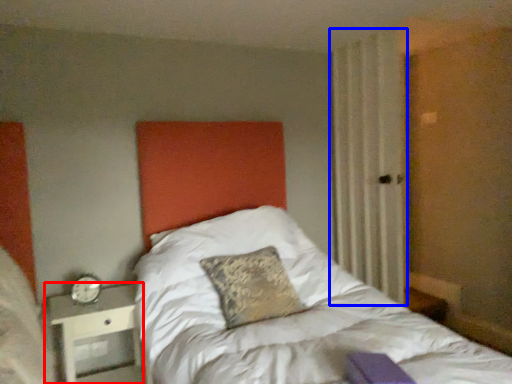
Question: Which object is further to the camera taking this photo, nightstand (highlighted by a red box) or curtain (highlighted by a blue box)?

Choices:
 (A) nightstand
 (B) curtain

Answer: (B)